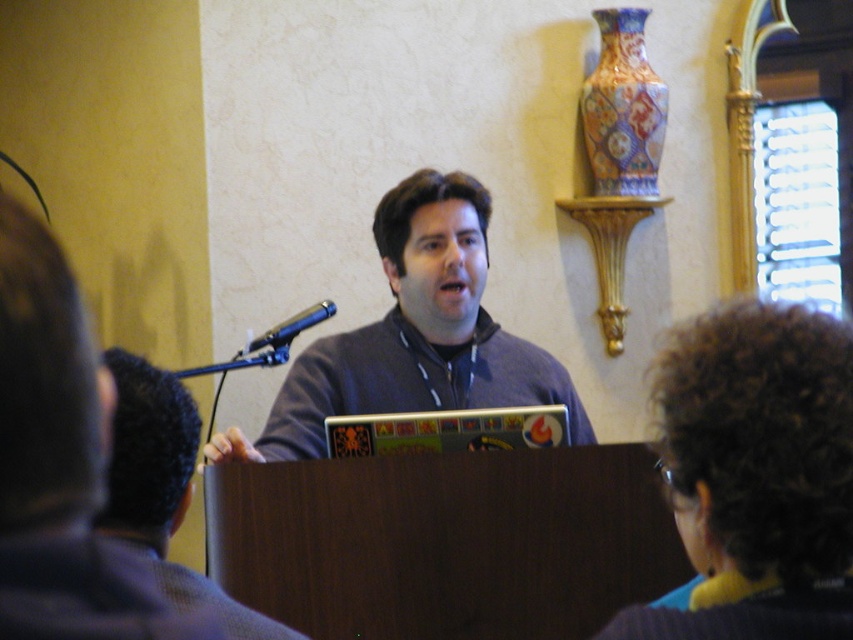
You are organizing a presentation and need to ensure that the gray matte laptop at center and the metallic blue microphone at center are positioned correctly. Which object should be placed higher to maintain proper visibility for the audience?

The gray matte laptop at center should be placed higher since it is taller than the metallic blue microphone at center, ensuring it is visible to the audience without obstruction.

You are a photographer taking a photo of the speaker at the podium. You notice a curly hair at upper right located at point (756, 474). Should you adjust your camera to avoid capturing this curly hair at upper right in the final image?

Yes, the curly hair at upper right is located at point (756, 474), which is likely in the frame. To maintain a professional appearance, adjusting the camera angle or removing the hair before shooting would be advisable.